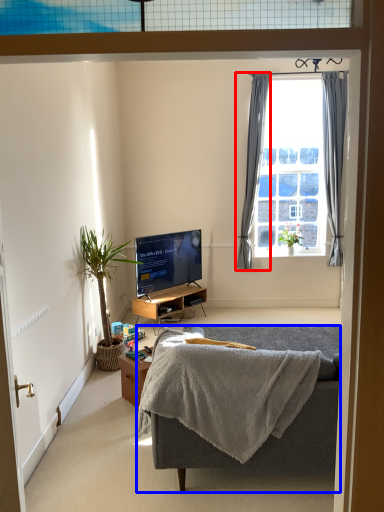
Question: Which of the following is the closest to the observer, curtain (highlighted by a red box) or studio couch (highlighted by a blue box)?

Choices:
 (A) curtain
 (B) studio couch

Answer: (B)